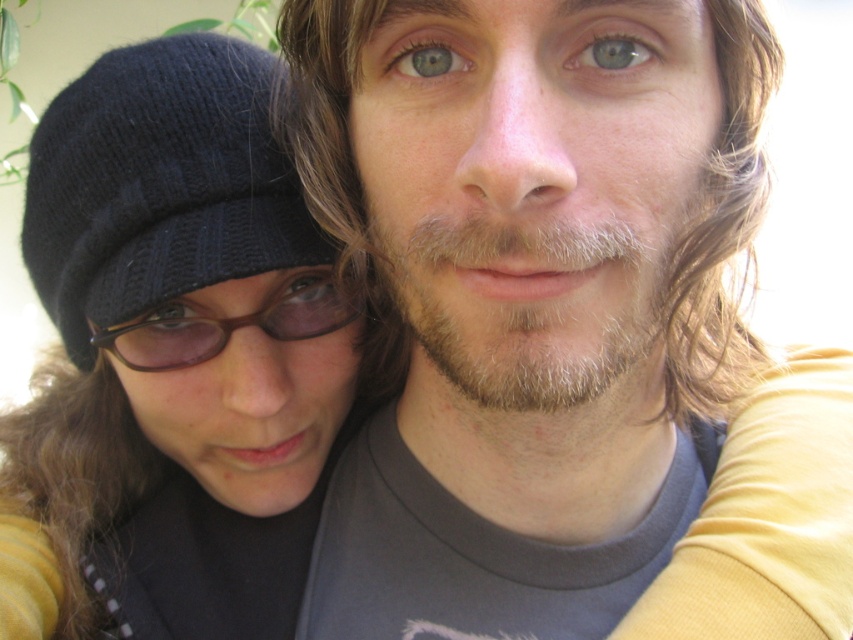
Does point (345, 10) lie in front of point (82, 342)?

Yes, it is.

Who is more distant from viewer, (519, 337) or (102, 259)?

Point (102, 259)

Find the location of `matte gray t-shirt at center`. matte gray t-shirt at center is located at coordinates (531, 298).

You are a GUI agent. You are given a task and a screenshot of the screen. Output one action in this format:
    pyautogui.click(x=<x>, y=<y>)
    Task: Click on the matte gray t-shirt at center
    This screenshot has height=640, width=853.
    Given the screenshot: What is the action you would take?
    pyautogui.click(x=531, y=298)

In order to click on black knitted hat at left in this screenshot , I will do `click(160, 184)`.

Does black knitted hat at left appear over brown matte glasses at center?

Correct, black knitted hat at left is located above brown matte glasses at center.

Measure the distance between point (x=169, y=56) and camera.

Point (x=169, y=56) and camera are 54.48 centimeters apart from each other.

Identify the location of black knitted hat at left. (160, 184).

Can you confirm if matte gray t-shirt at center is positioned to the right of brown matte glasses at center?

Indeed, matte gray t-shirt at center is positioned on the right side of brown matte glasses at center.

From the picture: Is matte gray t-shirt at center above brown matte glasses at center?

Yes.

Which is in front, point (602, 340) or point (300, 284)?

Point (602, 340) is in front.

In order to click on matte gray t-shirt at center in this screenshot , I will do `click(531, 298)`.